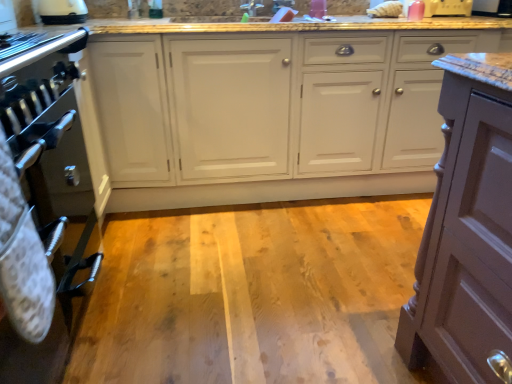
This screenshot has width=512, height=384. Describe the element at coordinates (492, 8) in the screenshot. I see `black glossy microwave at upper right, which is the second appliance from left to right` at that location.

Find the location of `pink plastic toaster at upper right, positioned as the 2th appliance in right-to-left order`. pink plastic toaster at upper right, positioned as the 2th appliance in right-to-left order is located at coordinates click(x=448, y=8).

Describe the element at coordinates (448, 8) in the screenshot. I see `pink plastic toaster at upper right, positioned as the 2th appliance in right-to-left order` at that location.

Identify the location of white glossy cabinets at center. (271, 113).

I want to click on white glossy faucet at upper center, so click(x=282, y=5).

Choose the correct answer: Is wooden floor at center inside metallic oven at left or outside it?

wooden floor at center lies outside metallic oven at left.

Can you confirm if wooden floor at center is thinner than metallic oven at left?

In fact, wooden floor at center might be wider than metallic oven at left.

Does wooden floor at center turn towards metallic oven at left?

No, wooden floor at center is not oriented towards metallic oven at left.

Would you consider wooden floor at center to be distant from metallic oven at left?

No, wooden floor at center is not far from metallic oven at left.

Would you say white glossy cabinets at center contains wooden floor at center?

No, white glossy cabinets at center does not contain wooden floor at center.

Is white glossy cabinets at center directly adjacent to wooden floor at center?

No, white glossy cabinets at center is not touching wooden floor at center.

Considering the sizes of objects white glossy cabinets at center and wooden floor at center in the image provided, who is taller, white glossy cabinets at center or wooden floor at center?

Standing taller between the two is white glossy cabinets at center.

Which object is closer to the camera taking this photo, white glossy cabinets at center or wooden floor at center?

wooden floor at center.

From the image's perspective, would you say wooden floor at center is shown under pink plastic toaster at upper right, the first appliance viewed from the left?

Indeed, from the image's perspective, wooden floor at center is shown beneath pink plastic toaster at upper right, the first appliance viewed from the left.

Does wooden floor at center touch pink plastic toaster at upper right, the first appliance viewed from the left?

wooden floor at center is not next to pink plastic toaster at upper right, the first appliance viewed from the left, and they're not touching.

In the image, is wooden floor at center positioned in front of or behind pink plastic toaster at upper right, the first appliance viewed from the left?

wooden floor at center is positioned closer to the viewer than pink plastic toaster at upper right, the first appliance viewed from the left.

Can you confirm if wooden floor at center is wider than pink plastic toaster at upper right, positioned as the 2th appliance in right-to-left order?

Indeed, wooden floor at center has a greater width compared to pink plastic toaster at upper right, positioned as the 2th appliance in right-to-left order.

From the picture: From the image's perspective, is white glossy kettle at upper left beneath metallic oven at left?

Incorrect, from the image's perspective, white glossy kettle at upper left is higher than metallic oven at left.

Is white glossy kettle at upper left thinner than metallic oven at left?

Indeed, white glossy kettle at upper left has a lesser width compared to metallic oven at left.

Can metallic oven at left be found inside white glossy kettle at upper left?

That's incorrect, metallic oven at left is not inside white glossy kettle at upper left.

Is white glossy kettle at upper left touching metallic oven at left?

white glossy kettle at upper left and metallic oven at left are not in contact.

How far apart are white glossy cabinets at center and black glossy microwave at upper right, the 1th appliance in the right-to-left sequence?

white glossy cabinets at center and black glossy microwave at upper right, the 1th appliance in the right-to-left sequence, are 1.10 meters apart from each other.

Is white glossy cabinets at center next to black glossy microwave at upper right, the 1th appliance in the right-to-left sequence?

There is a gap between white glossy cabinets at center and black glossy microwave at upper right, the 1th appliance in the right-to-left sequence.

At what (x,y) coordinates should I click in order to perform the action: click on the 2nd appliance positioned above the white glossy cabinets at center (from the image's perspective). Please return your answer as a coordinate pair (x, y). This screenshot has width=512, height=384. Looking at the image, I should click on (492, 8).

Is white glossy cabinets at center situated inside pink plastic toaster at upper right, positioned as the 2th appliance in right-to-left order, or outside?

white glossy cabinets at center is not inside pink plastic toaster at upper right, positioned as the 2th appliance in right-to-left order, it's outside.

From a real-world perspective, who is located higher, white glossy cabinets at center or pink plastic toaster at upper right, the first appliance viewed from the left?

pink plastic toaster at upper right, the first appliance viewed from the left.

Is point (392, 53) less distant than point (454, 3)?

Yes.

What are the coordinates of `home appliance below the white glossy cabinets at center (from the image's perspective)` in the screenshot? It's located at (42, 210).

Is point (4, 380) closer to viewer compared to point (403, 160)?

Yes, point (4, 380) is closer to viewer.

From the image's perspective, is metallic oven at left beneath white glossy cabinets at center?

Indeed, from the image's perspective, metallic oven at left is shown beneath white glossy cabinets at center.

From a real-world perspective, is metallic oven at left on top of white glossy cabinets at center?

Incorrect, from a real-world perspective, metallic oven at left is lower than white glossy cabinets at center.

This screenshot has width=512, height=384. I want to click on plain below the metallic oven at left (from the image's perspective), so click(253, 294).

This screenshot has height=384, width=512. I want to click on cabinetry located behind the wooden floor at center, so click(x=271, y=113).

Estimate the real-world distances between objects in this image. Which object is closer to white glossy faucet at upper center, metallic oven at left or wooden floor at center?

Based on the image, wooden floor at center appears to be nearer to white glossy faucet at upper center.

Considering their positions, is white glossy faucet at upper center positioned closer to pink plastic toaster at upper right, the first appliance viewed from the left, than wooden floor at center?

white glossy faucet at upper center is closer to pink plastic toaster at upper right, the first appliance viewed from the left.

Which object lies further to the anchor point metallic oven at left, wooden floor at center or black glossy microwave at upper right, the 1th appliance in the right-to-left sequence?

black glossy microwave at upper right, the 1th appliance in the right-to-left sequence, is positioned further to the anchor metallic oven at left.

Estimate the real-world distances between objects in this image. Which object is closer to metallic oven at left, pink plastic toaster at upper right, positioned as the 2th appliance in right-to-left order, or wooden floor at center?

wooden floor at center.

Looking at the image, which one is located closer to white glossy kettle at upper left, metallic oven at left or white glossy cabinets at center?

Based on the image, white glossy cabinets at center appears to be nearer to white glossy kettle at upper left.

When comparing their distances from pink plastic toaster at upper right, the first appliance viewed from the left, does wooden floor at center or metallic oven at left seem further?

Among the two, metallic oven at left is located further to pink plastic toaster at upper right, the first appliance viewed from the left.

When comparing their distances from black glossy microwave at upper right, the 1th appliance in the right-to-left sequence, does wooden floor at center or white glossy cabinets at center seem further?

Based on the image, wooden floor at center appears to be further to black glossy microwave at upper right, the 1th appliance in the right-to-left sequence.

Looking at the image, which one is located closer to wooden floor at center, pink plastic toaster at upper right, the first appliance viewed from the left, or black glossy microwave at upper right, which is the second appliance from left to right?

pink plastic toaster at upper right, the first appliance viewed from the left.

Where is `home appliance between white glossy kettle at upper left and black glossy microwave at upper right, the 1th appliance in the right-to-left sequence`? home appliance between white glossy kettle at upper left and black glossy microwave at upper right, the 1th appliance in the right-to-left sequence is located at coordinates (42, 210).

You are a GUI agent. You are given a task and a screenshot of the screen. Output one action in this format:
    pyautogui.click(x=<x>, y=<y>)
    Task: Click on the plain between metallic oven at left and white glossy kettle at upper left in the front-back direction
    Image resolution: width=512 pixels, height=384 pixels.
    Given the screenshot: What is the action you would take?
    pyautogui.click(x=253, y=294)

In order to click on cabinetry situated between white glossy faucet at upper center and pink plastic toaster at upper right, positioned as the 2th appliance in right-to-left order, from left to right in this screenshot , I will do `click(271, 113)`.

Find the location of a particular element. kitchen appliance between metallic oven at left and white glossy faucet at upper center in the front-back direction is located at coordinates (62, 11).